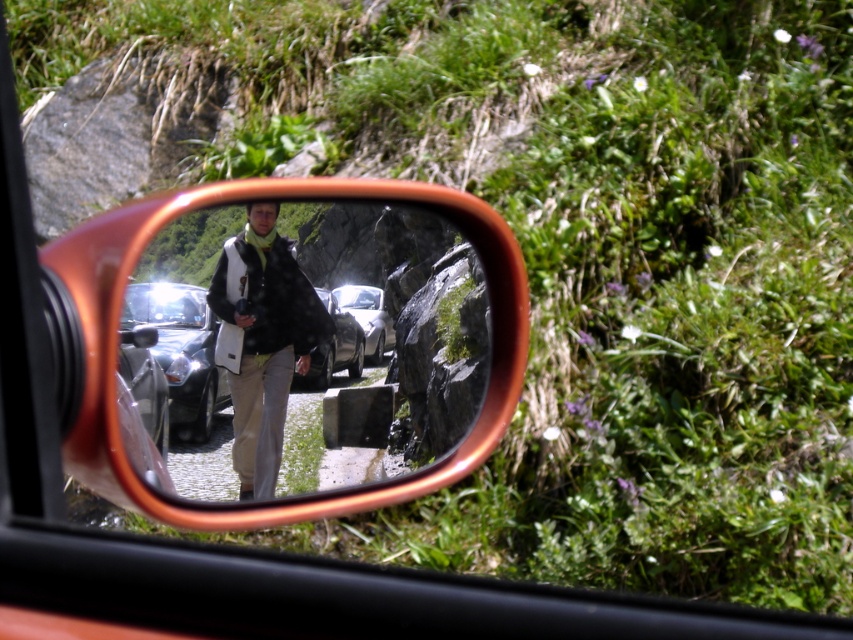
You are driving a car and notice a person in a matte black jacket at center and a shiny silver car at center reflected in your side mirror. Based on the reflection, which object is closer to the right edge of the mirror?

The matte black jacket at center is positioned on the right side of the shiny silver car at center, so the matte black jacket at center is closer to the right edge of the mirror.